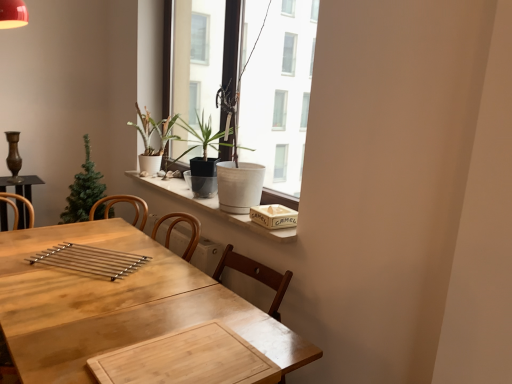
Locate an element on the screen. Image resolution: width=512 pixels, height=384 pixels. vacant region in front of polished metal tray at center is located at coordinates (61, 296).